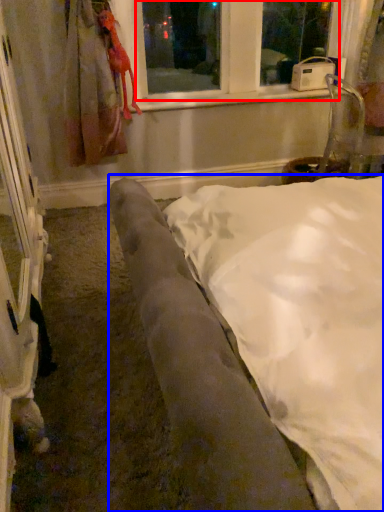
Question: Which object is further to the camera taking this photo, bay window (highlighted by a red box) or furniture (highlighted by a blue box)?

Choices:
 (A) bay window
 (B) furniture

Answer: (A)